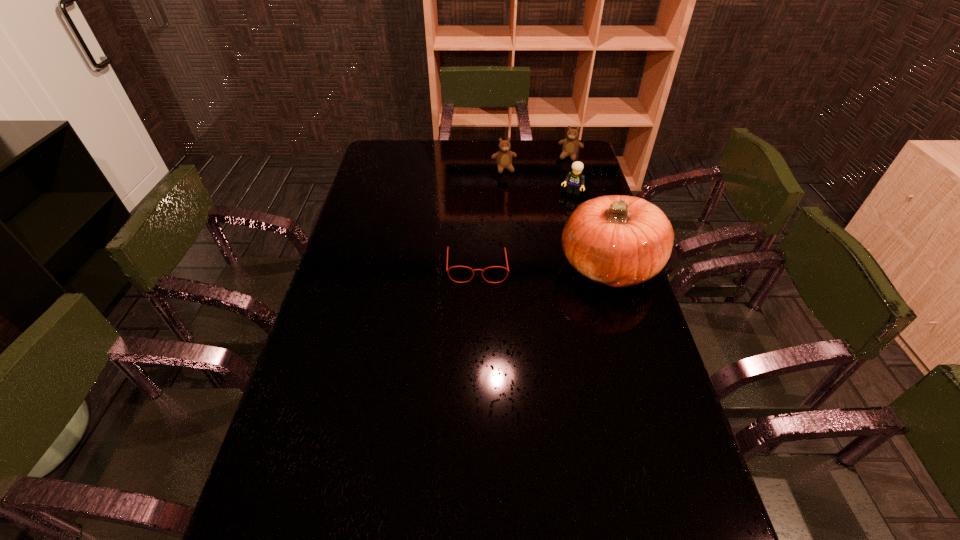
Image resolution: width=960 pixels, height=540 pixels. I want to click on vacant space on the desktop that is between the spectacles and the pumpkin and is positioned at the face of the left teddy bear, so click(x=540, y=266).

At what (x,y) coordinates should I click in order to perform the action: click on free spot on the desktop that is between the spectacles and the tallest object and is positioned at the face of the farthest object. Please return your answer as a coordinate pair (x, y). This screenshot has height=540, width=960. Looking at the image, I should click on (531, 266).

Image resolution: width=960 pixels, height=540 pixels. Find the location of `free spot on the desktop that is between the shortest object and the pumpkin and is positioned on the front-facing side of the third farthest object`. free spot on the desktop that is between the shortest object and the pumpkin and is positioned on the front-facing side of the third farthest object is located at coordinates (538, 266).